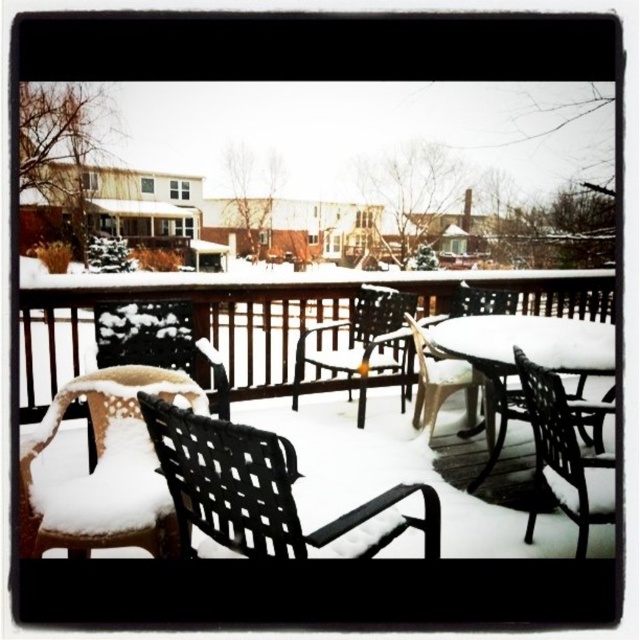
Question: Which of the following is the closest to the observer?

Choices:
 (A) (348, 320)
 (B) (83, 381)
 (C) (188, 410)

Answer: (C)

Question: Is the position of white plastic chair at lower left more distant than that of black woven chair at lower right?

Choices:
 (A) yes
 (B) no

Answer: (B)

Question: Does black woven chair at lower right appear on the left side of black plastic chair at center?

Choices:
 (A) yes
 (B) no

Answer: (A)

Question: Is white plastic chair at lower left to the right of black woven chair at lower right from the viewer's perspective?

Choices:
 (A) no
 (B) yes

Answer: (A)

Question: Which point appears closest to the camera in this image?

Choices:
 (A) (52, 524)
 (B) (593, 323)

Answer: (A)

Question: Based on their relative distances, which object is farther from the black woven chair at lower left?

Choices:
 (A) black plastic chair at center
 (B) black woven chair at lower right
 (C) white woven chair at lower left
 (D) white plastic chair at lower left

Answer: (A)